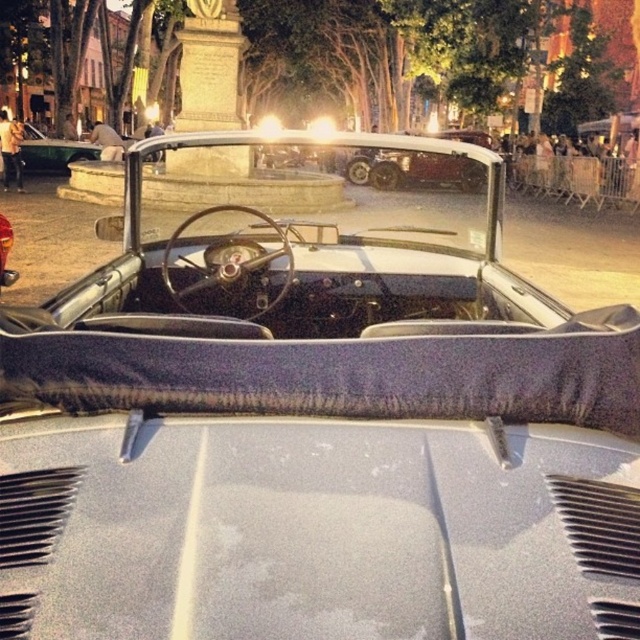
Question: Where is clear glass windshield at center located in relation to matte black convertible at left in the image?

Choices:
 (A) left
 (B) right

Answer: (B)

Question: From the image, what is the correct spatial relationship of clear glass windshield at center in relation to matte black convertible at left?

Choices:
 (A) below
 (B) above

Answer: (A)

Question: Among these points, which one is farthest from the camera?

Choices:
 (A) (141, 141)
 (B) (17, 140)

Answer: (B)

Question: Can you confirm if clear glass windshield at center is positioned to the left of matte black convertible at left?

Choices:
 (A) no
 (B) yes

Answer: (A)